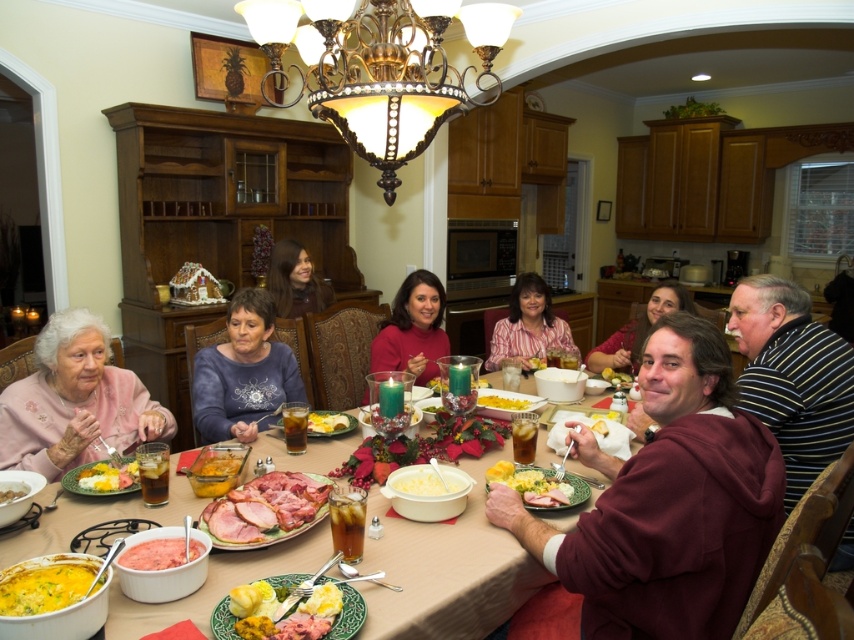
Can you confirm if gold metallic chandelier at upper center is positioned below yellow mashed potatoes at center?

No, gold metallic chandelier at upper center is not below yellow mashed potatoes at center.

Measure the distance between gold metallic chandelier at upper center and camera.

gold metallic chandelier at upper center is 1.66 meters from camera.

Image resolution: width=854 pixels, height=640 pixels. I want to click on gold metallic chandelier at upper center, so click(381, 68).

Which is more to the right, pink glossy ham at center or yellow cheesy casserole at center?

pink glossy ham at center is more to the right.

Does point (161, 545) come behind point (85, 472)?

No, (161, 545) is closer to viewer.

Identify the location of pink glossy ham at center. This screenshot has width=854, height=640. (161, 554).

Which is below, smooth brown hair at center or yellow matte casserole at center?

yellow matte casserole at center is lower down.

Is point (291, 257) behind point (498, 406)?

Yes, point (291, 257) is behind point (498, 406).

This screenshot has height=640, width=854. Identify the location of smooth brown hair at center. (295, 280).